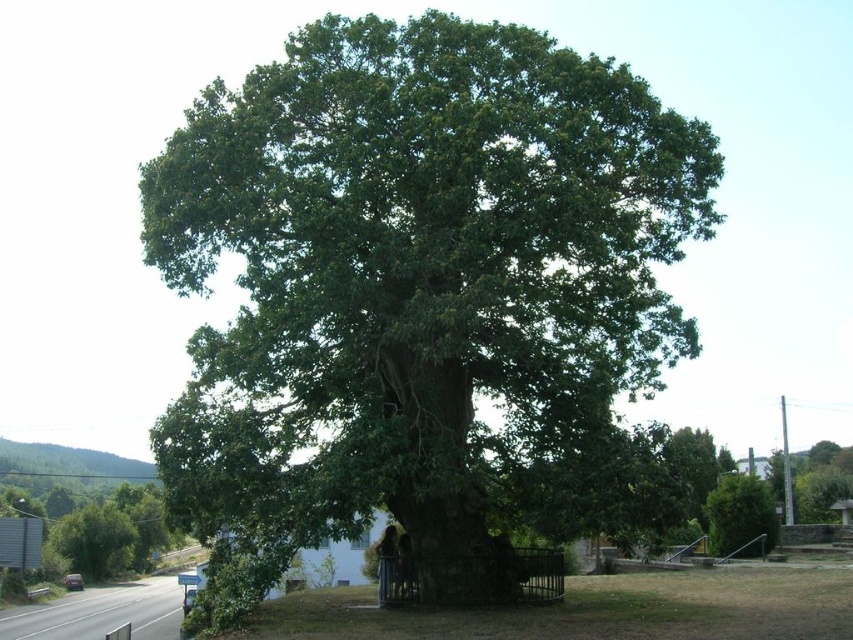
You are a bird flying over a suburban area and want to land on the highest point between the green leafy oak tree at center and the green leafy tree at center. Which tree should you choose?

The green leafy oak tree at center is above the green leafy tree at center, so you should choose the green leafy oak tree at center to land on the highest point.

You are a gardener assessing the trees in a park. You see the green leafy oak tree at center and the green leafy tree at center. Which tree is taller?

The green leafy oak tree at center is taller than the green leafy tree at center.